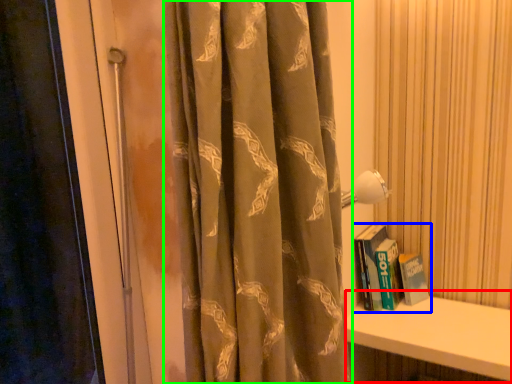
Question: Which object is the farthest from window sill (highlighted by a red box)? Choose among these: book (highlighted by a blue box) or curtain (highlighted by a green box).

Choices:
 (A) book
 (B) curtain

Answer: (B)